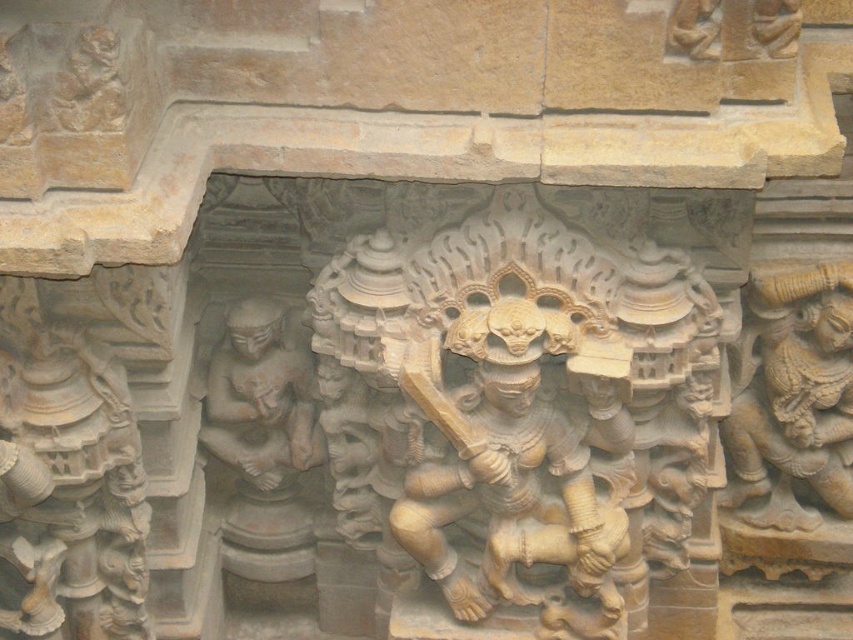
Looking at this image, based on the scene description, which object is bigger between the golden stone warrior at center and the smooth stone figure at center?

The golden stone warrior at center is larger in size than the smooth stone figure at center.

You are an archaeologist examining the stone relief. You notice two central figures, the golden stone warrior at center and the smooth stone figure at center. Which one appears to be in front of the other?

The golden stone warrior at center is closer to the viewer than the smooth stone figure at center, so it appears in front of the smooth stone figure at center.